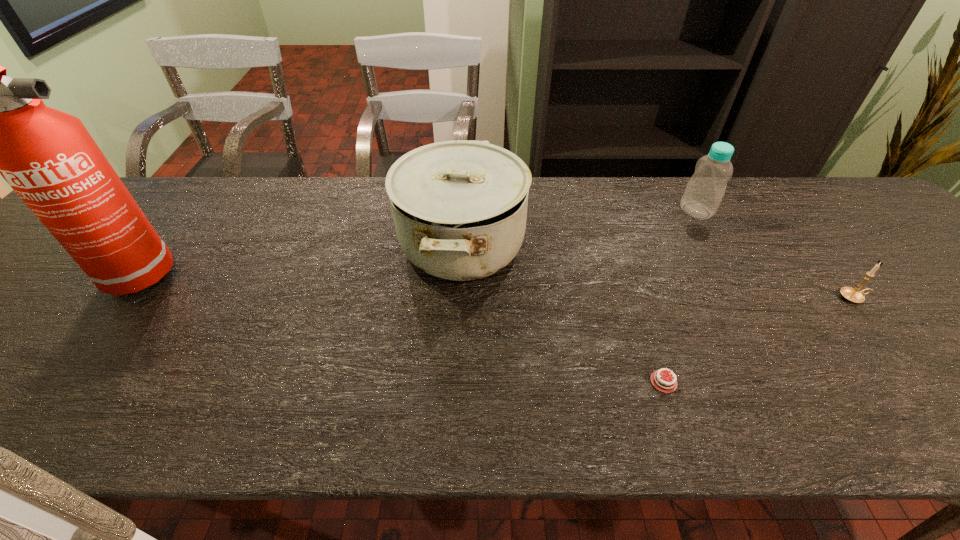
Where is `vacant space located on the left of the fourth object from left to right`? This screenshot has height=540, width=960. vacant space located on the left of the fourth object from left to right is located at coordinates (650, 211).

This screenshot has width=960, height=540. What are the coordinates of `vacant space located 0.170m on the handle side of the rightmost object` in the screenshot? It's located at (940, 297).

Locate an element on the screen. This screenshot has width=960, height=540. free location located on the back of the chocolate cake is located at coordinates (642, 316).

Locate an element on the screen. Image resolution: width=960 pixels, height=540 pixels. saucepan present at the far edge is located at coordinates (459, 207).

The image size is (960, 540). What are the coordinates of `bottle that is positioned at the far edge` in the screenshot? It's located at (704, 192).

You are a GUI agent. You are given a task and a screenshot of the screen. Output one action in this format:
    pyautogui.click(x=<x>, y=<y>)
    Task: Click on the object positioned at the near edge
    This screenshot has height=540, width=960.
    Given the screenshot: What is the action you would take?
    pyautogui.click(x=660, y=380)

Image resolution: width=960 pixels, height=540 pixels. Identify the location of object positioned at the left edge. (0, 126).

You are a GUI agent. You are given a task and a screenshot of the screen. Output one action in this format:
    pyautogui.click(x=<x>, y=<y>)
    Task: Click on the blank space at the far edge
    This screenshot has width=960, height=540.
    Given the screenshot: What is the action you would take?
    pyautogui.click(x=803, y=198)

In the image, there is a desktop. What are the coordinates of `free space at the near edge` in the screenshot? It's located at (626, 414).

Image resolution: width=960 pixels, height=540 pixels. I want to click on free region at the right edge of the desktop, so click(923, 297).